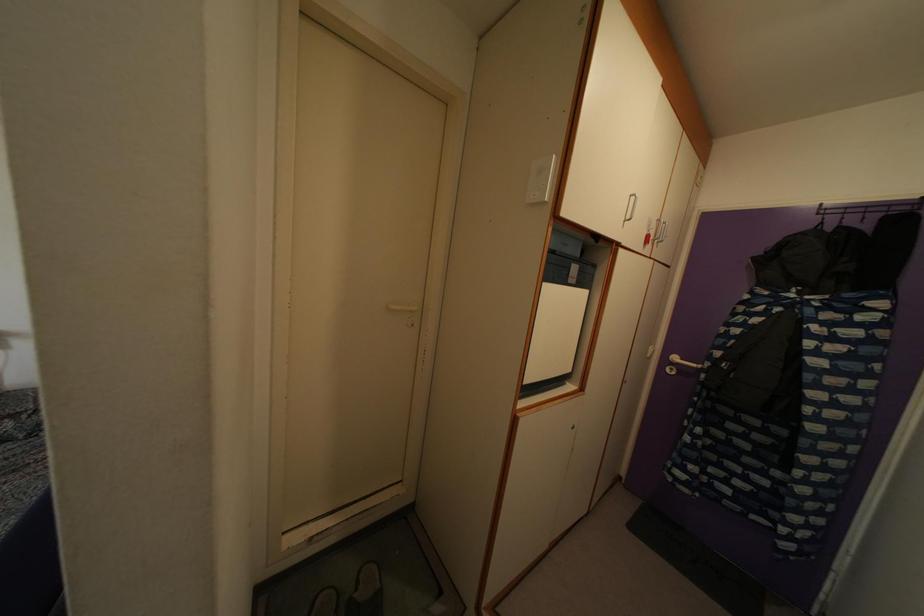
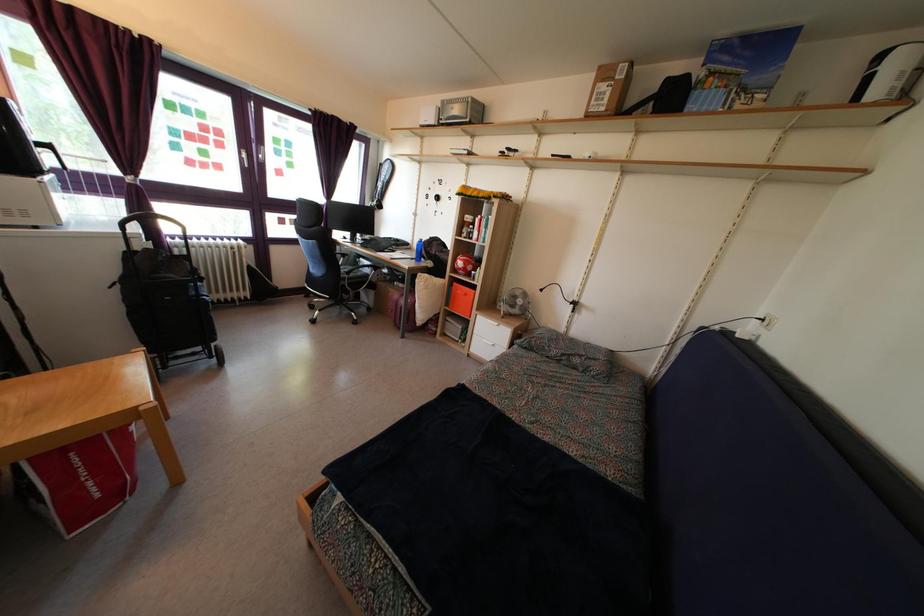
Question: Based on the continuous images, in which direction is the camera rotating? Reply with the corresponding letter.

Choices:
 (A) Left
 (B) Right
 (C) Up
 (D) Down

Answer: (A)